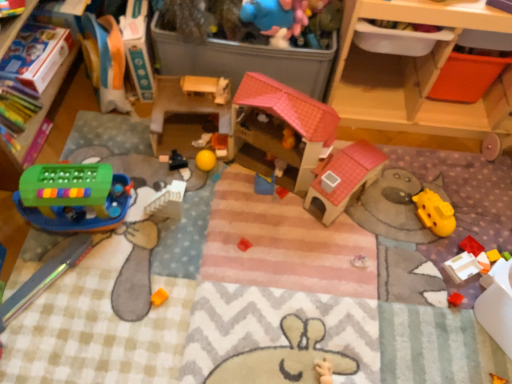
Where is `free spot to the right of yellow rubber ball at center, which is counted as the 4th toy, starting from the right`? Image resolution: width=512 pixels, height=384 pixels. free spot to the right of yellow rubber ball at center, which is counted as the 4th toy, starting from the right is located at coordinates (258, 165).